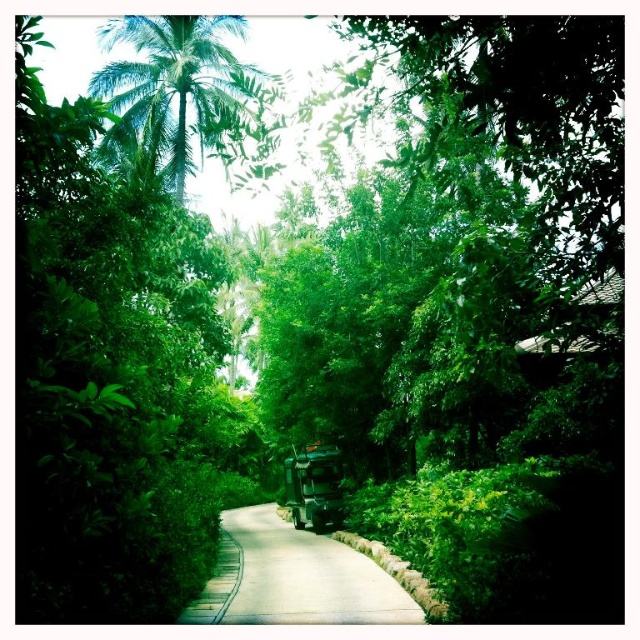
Based on the photo, you are a hiker walking along the smooth asphalt path at center and want to take a photo of the green leafy palm tree at upper left. Which direction should you face to capture the tree in your shot?

The green leafy palm tree at upper left is located above the smooth asphalt path at center, so you should look upward while facing the direction of the tree to capture it in your photo.

You are a delivery person trying to reach the metallic green truck at center. The smooth asphalt path at center is in front of it. Can you walk directly to the truck along the path without going around?

Yes, you can walk directly to the metallic green truck at center along the smooth asphalt path at center because the path is in front of the truck, indicating it leads directly to it.

You are standing at the entrance of the tropical pathway and want to locate the green leafy palm tree at upper left. According to the coordinates provided, where exactly is it positioned?

The green leafy palm tree at upper left is positioned at coordinates point (177, 83).